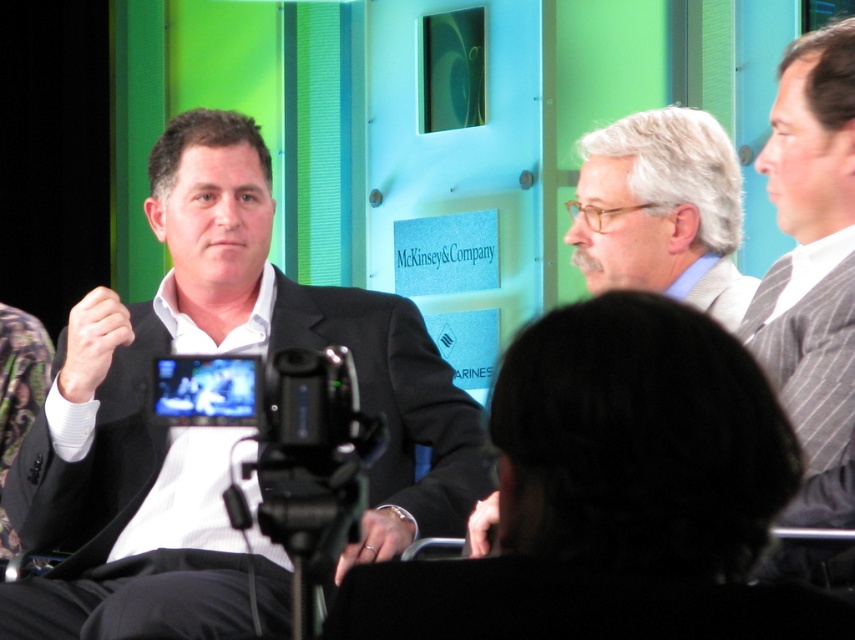
Does black matte suit at center have a lesser width compared to gray striped sweater at right?

In fact, black matte suit at center might be wider than gray striped sweater at right.

Which is above, black matte suit at center or gray striped sweater at right?

gray striped sweater at right is higher up.

Does point (92, 625) come farther from viewer compared to point (814, 266)?

No.

Locate an element on the screen. black matte suit at center is located at coordinates (394, 396).

Is black matte suit at center above gray textured suit at center?

No.

Between black matte suit at center and gray textured suit at center, which one appears on the left side from the viewer's perspective?

black matte suit at center is more to the left.

Is point (130, 480) more distant than point (733, 211)?

No, it is not.

The height and width of the screenshot is (640, 855). In order to click on black matte suit at center in this screenshot , I will do `click(394, 396)`.

Does point (791, 369) come in front of point (705, 237)?

That is True.

How much distance is there between gray striped sweater at right and gray textured suit at center?

A distance of 34.48 inches exists between gray striped sweater at right and gray textured suit at center.

Who is more forward, (814,292) or (588,132)?

Point (814,292)

Where is `gray striped sweater at right`? The image size is (855, 640). gray striped sweater at right is located at coordinates (812, 266).